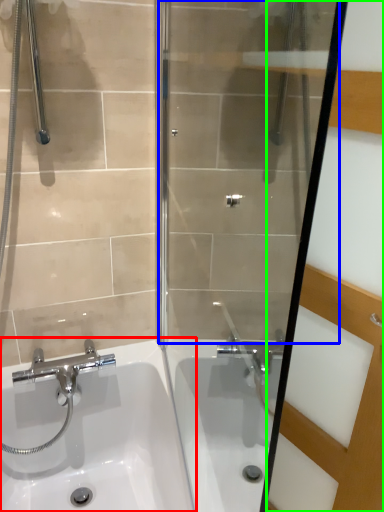
Question: Which object is positioned closest to sink (highlighted by a red box)? Select from shower door (highlighted by a blue box) and screen door (highlighted by a green box).

Choices:
 (A) shower door
 (B) screen door

Answer: (A)